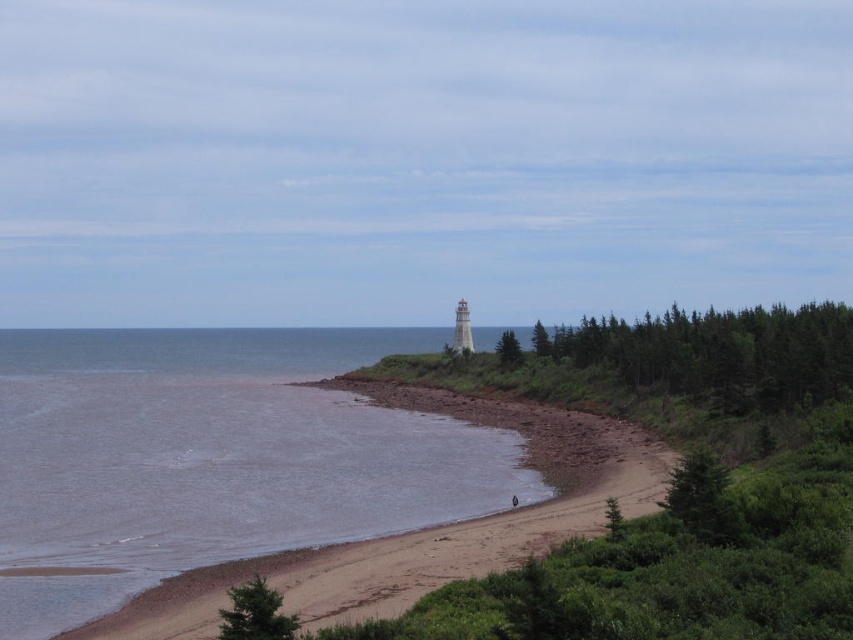
Question: Considering the real-world distances, which object is farthest from the green leafy tree at center?

Choices:
 (A) green matte trees at right
 (B) dark blue fabric at lower center

Answer: (B)

Question: Which point is farther to the camera?

Choices:
 (A) green matte trees at right
 (B) green leafy tree at center
 (C) brown sand at lower left
 (D) dark blue fabric at lower center

Answer: (B)

Question: Considering the relative positions of brown sand at lower left and dark blue fabric at lower center in the image provided, where is brown sand at lower left located with respect to dark blue fabric at lower center?

Choices:
 (A) left
 (B) right

Answer: (A)

Question: Can you confirm if green matte trees at right is bigger than dark blue fabric at lower center?

Choices:
 (A) no
 (B) yes

Answer: (B)

Question: Does brown sand at lower left have a larger size compared to green matte tree at lower right?

Choices:
 (A) yes
 (B) no

Answer: (A)

Question: Which is farther from the brown sand at lower left?

Choices:
 (A) dark blue fabric at lower center
 (B) green matte trees at right

Answer: (A)